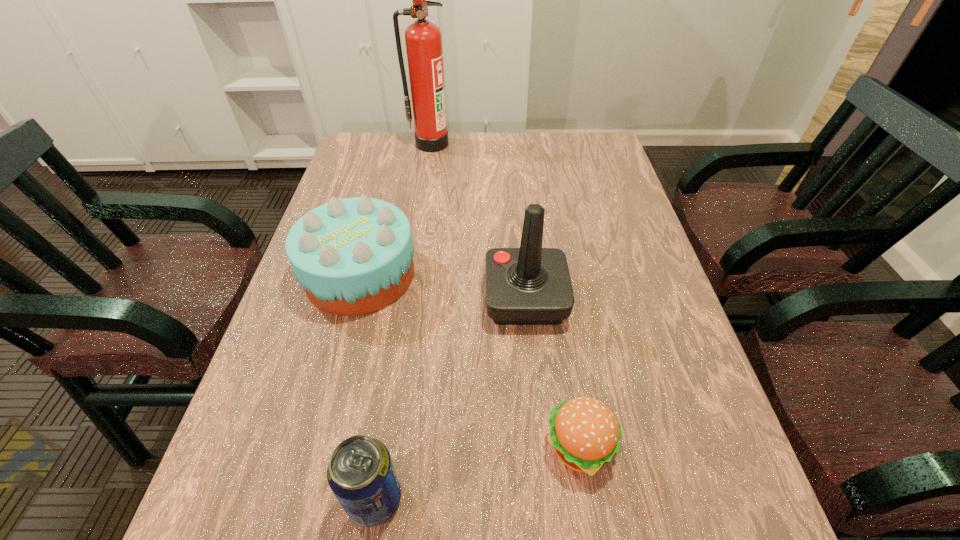
Where is `free space located 0.300m on the back of the shortest object`? The image size is (960, 540). free space located 0.300m on the back of the shortest object is located at coordinates coord(556,292).

Locate an element on the screen. The width and height of the screenshot is (960, 540). object at the far edge is located at coordinates (423, 39).

This screenshot has width=960, height=540. In order to click on object at the near edge in this screenshot , I will do `click(361, 474)`.

Identify the location of object at the left edge. Image resolution: width=960 pixels, height=540 pixels. (353, 256).

In the image, there is a desktop. Where is `vacant area at the far edge`? The height and width of the screenshot is (540, 960). vacant area at the far edge is located at coordinates (530, 147).

In the image, there is a desktop. Where is `vacant region at the near edge`? This screenshot has height=540, width=960. vacant region at the near edge is located at coordinates (404, 537).

I want to click on vacant area at the left edge, so click(267, 376).

Locate an element on the screen. The width and height of the screenshot is (960, 540). free space at the right edge is located at coordinates (588, 223).

Image resolution: width=960 pixels, height=540 pixels. Identify the location of free space at the far right corner of the desktop. (580, 150).

The image size is (960, 540). What are the coordinates of `vacant space that is in between the shortest object and the soda` in the screenshot? It's located at point(477,472).